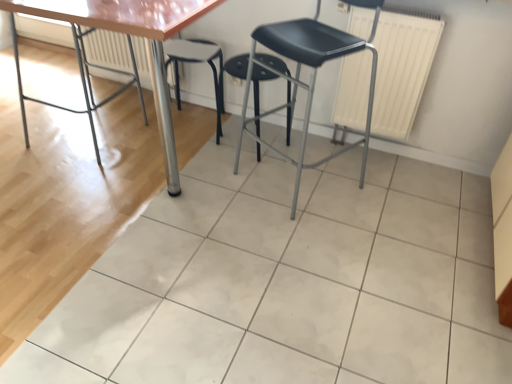
Question: Is metallic polished table at left at the right side of white matte radiator at upper right, placed as the 2th radiator when sorted from left to right?

Choices:
 (A) yes
 (B) no

Answer: (B)

Question: From a real-world perspective, is metallic polished table at left over white matte radiator at upper right, which appears as the 1th radiator when viewed from the right?

Choices:
 (A) yes
 (B) no

Answer: (B)

Question: Does metallic polished table at left have a greater height compared to white matte radiator at upper right, the second radiator positioned from the back?

Choices:
 (A) yes
 (B) no

Answer: (A)

Question: Is metallic polished table at left in contact with white matte radiator at upper right, the second radiator positioned from the back?

Choices:
 (A) yes
 (B) no

Answer: (B)

Question: Does metallic polished table at left have a smaller size compared to white matte radiator at upper right, placed as the 2th radiator when sorted from left to right?

Choices:
 (A) no
 (B) yes

Answer: (A)

Question: From a real-world perspective, is metallic polished table at left below white matte radiator at upper right, placed as the 2th radiator when sorted from left to right?

Choices:
 (A) yes
 (B) no

Answer: (A)

Question: Is the position of black plastic stool at center, the 1th stool viewed from the right, less distant than that of black plastic stool at center, arranged as the 1th stool when viewed from the left?

Choices:
 (A) yes
 (B) no

Answer: (A)

Question: Does black plastic stool at center, acting as the second stool starting from the left, turn towards black plastic stool at center, arranged as the 1th stool when viewed from the left?

Choices:
 (A) no
 (B) yes

Answer: (A)

Question: Does black plastic stool at center, the 1th stool viewed from the right, have a lesser width compared to black plastic stool at center, the second stool from the right?

Choices:
 (A) yes
 (B) no

Answer: (B)

Question: Considering the relative sizes of black plastic stool at center, acting as the second stool starting from the left, and black plastic stool at center, arranged as the 1th stool when viewed from the left, in the image provided, is black plastic stool at center, acting as the second stool starting from the left, smaller than black plastic stool at center, arranged as the 1th stool when viewed from the left,?

Choices:
 (A) no
 (B) yes

Answer: (B)

Question: From the image's perspective, is black plastic stool at center, the 1th stool viewed from the right, below black plastic stool at center, the second stool from the right?

Choices:
 (A) yes
 (B) no

Answer: (A)

Question: Is black plastic stool at center, the 1th stool viewed from the right, not inside black plastic stool at center, arranged as the 1th stool when viewed from the left?

Choices:
 (A) no
 (B) yes

Answer: (B)

Question: Is white matte radiator at upper right, which appears as the first radiator when viewed from the front, not inside white glossy tile at center?

Choices:
 (A) no
 (B) yes

Answer: (B)